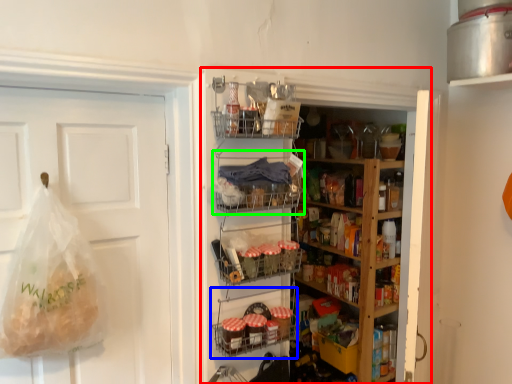
Question: Which is nearer to the shelf (highlighted by a red box)? shelf (highlighted by a blue box) or shelf (highlighted by a green box).

Choices:
 (A) shelf
 (B) shelf

Answer: (A)